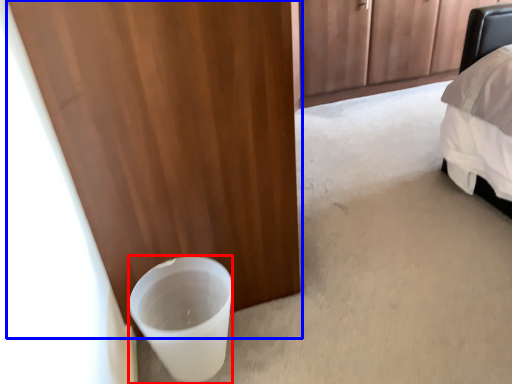
Question: Which point is closer to the camera, beverage (highlighted by a red box) or door (highlighted by a blue box)?

Choices:
 (A) beverage
 (B) door

Answer: (B)